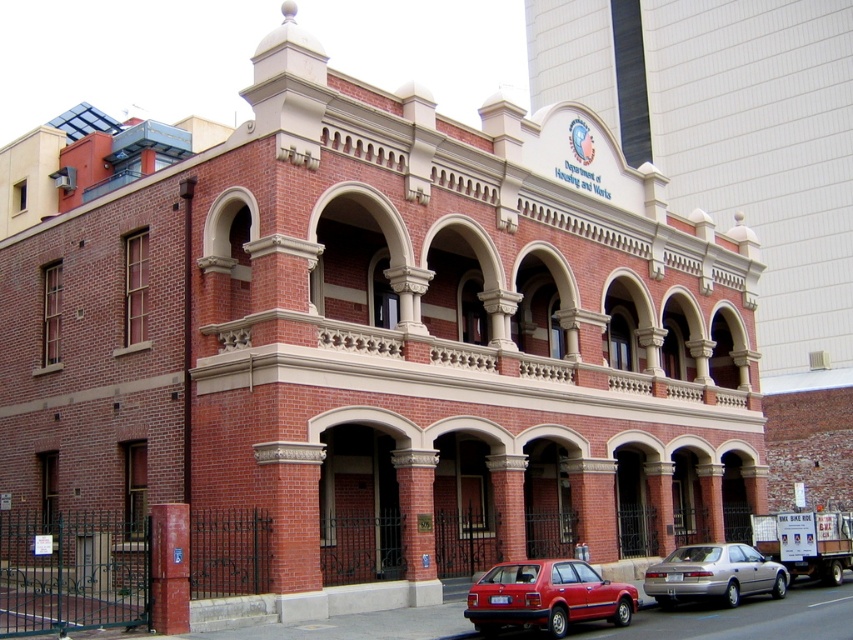
Is silver metallic sedan at lower right to the right of brick pillar at center from the viewer's perspective?

Yes, silver metallic sedan at lower right is to the right of brick pillar at center.

Is silver metallic sedan at lower right to the left of brick pillar at center from the viewer's perspective?

No, silver metallic sedan at lower right is not to the left of brick pillar at center.

Which is behind, point (712, 564) or point (177, 563)?

Positioned behind is point (712, 564).

Where is `silver metallic sedan at lower right`? This screenshot has height=640, width=853. silver metallic sedan at lower right is located at coordinates (712, 573).

Does matte red sedan at lower center appear over silver metallic sedan at lower right?

Yes, matte red sedan at lower center is above silver metallic sedan at lower right.

Can you confirm if matte red sedan at lower center is smaller than silver metallic sedan at lower right?

Correct, matte red sedan at lower center occupies less space than silver metallic sedan at lower right.

Who is more forward, (569, 582) or (735, 596)?

Point (569, 582) is in front.

The image size is (853, 640). Find the location of `matte red sedan at lower center`. matte red sedan at lower center is located at coordinates (546, 596).

Is matte red sedan at lower center shorter than brick pillar at center?

Correct, matte red sedan at lower center is not as tall as brick pillar at center.

Is matte red sedan at lower center to the left of brick pillar at center from the viewer's perspective?

No, matte red sedan at lower center is not to the left of brick pillar at center.

Is point (582, 611) positioned after point (161, 620)?

Yes, it is behind point (161, 620).

The image size is (853, 640). Identify the location of matte red sedan at lower center. (546, 596).